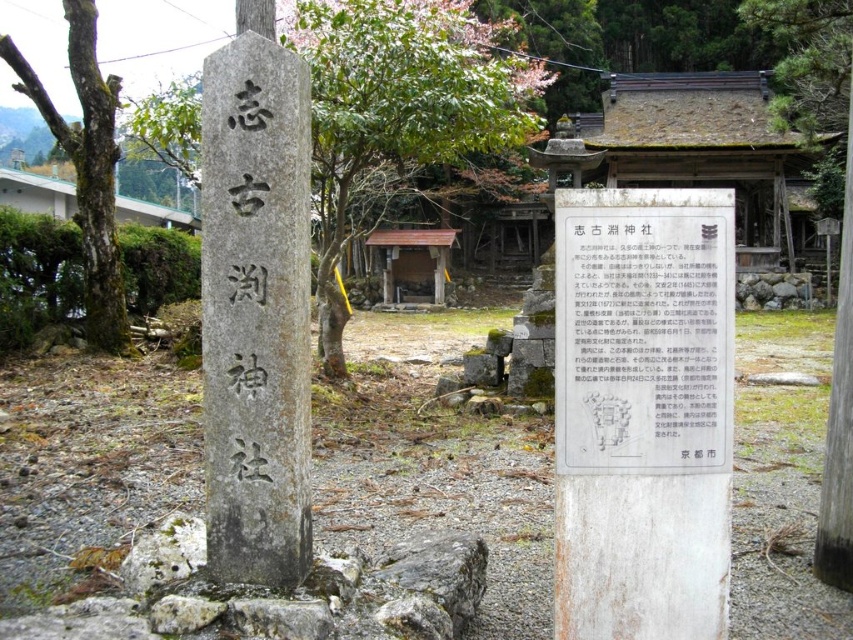
Question: Which object appears farthest from the camera in this image?

Choices:
 (A) white paper sign at center
 (B) gray stone monument at center
 (C) smooth bark tree at left

Answer: (C)

Question: Observing the image, what is the correct spatial positioning of white paper sign at center in reference to smooth bark tree at left?

Choices:
 (A) left
 (B) right

Answer: (B)

Question: Among these points, which one is farthest from the camera?

Choices:
 (A) (93, 284)
 (B) (579, 288)
 (C) (212, 468)

Answer: (A)

Question: Which point is farther from the camera taking this photo?

Choices:
 (A) (596, 330)
 (B) (247, 580)

Answer: (B)

Question: Is white paper sign at center positioned before smooth bark tree at left?

Choices:
 (A) yes
 (B) no

Answer: (A)

Question: Does white paper sign at center appear over smooth bark tree at left?

Choices:
 (A) yes
 (B) no

Answer: (B)